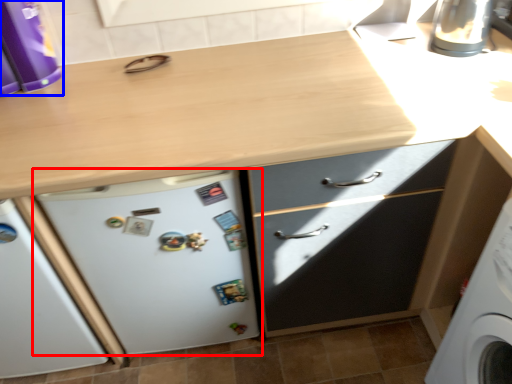
Question: Which point is further to the camera, refrigerator (highlighted by a red box) or kitchen appliance (highlighted by a blue box)?

Choices:
 (A) refrigerator
 (B) kitchen appliance

Answer: (A)